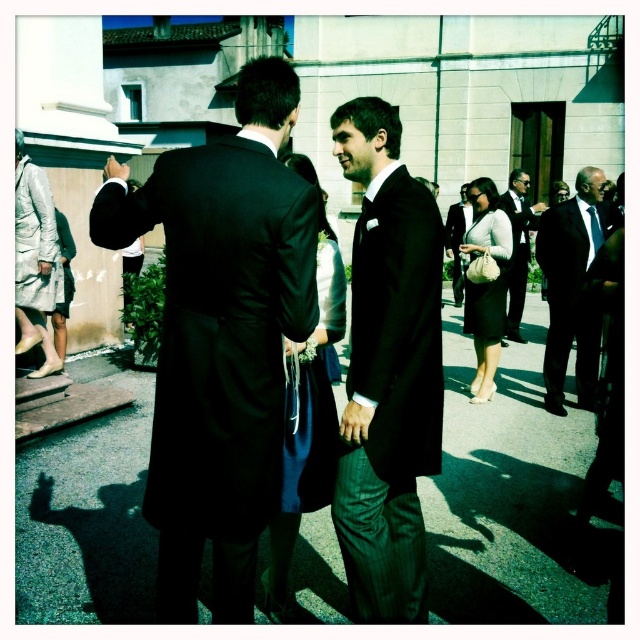
You are a photographer at a wedding. You want to take a photo of the silky blue dress at center and the smooth asphalt pavement at center. Which object is closer to the camera?

The silky blue dress at center is behind the smooth asphalt pavement at center, so the smooth asphalt pavement at center is closer to the camera.

Looking at this image, you are a photographer at a wedding and need to adjust the lighting to ensure both the matte black dress at center and the black silk suit at center are visible. Since both are black, how can you use their positions to help differentiate them in the photo?

The matte black dress at center is located below the black silk suit at center, so positioning the light source above the black silk suit at center will create a shadow that helps distinguish the two by their vertical placement.